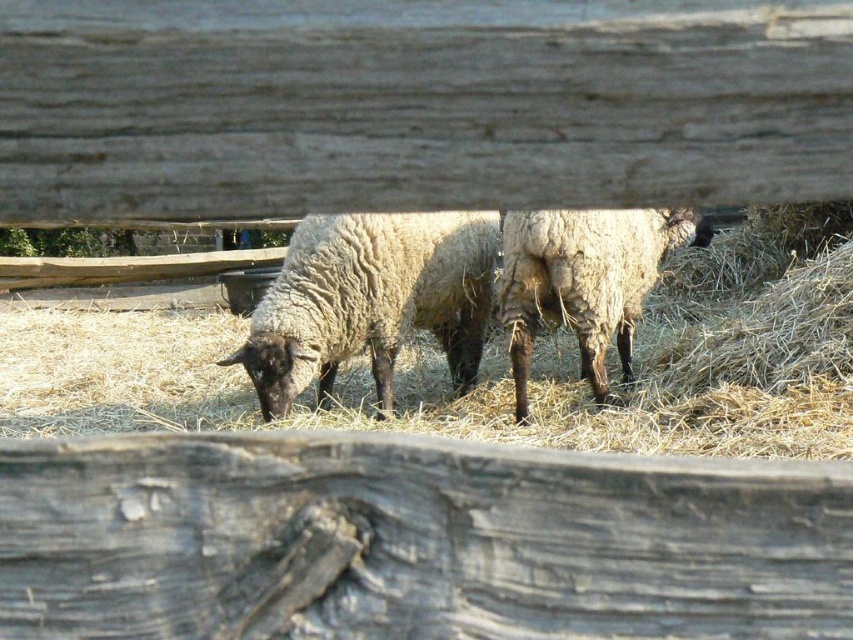
Does light brown straw at center appear on the left side of fuzzy white sheep at center?

Incorrect, light brown straw at center is not on the left side of fuzzy white sheep at center.

Is point (161, 362) more distant than point (376, 380)?

Yes, point (161, 362) is farther from viewer.

Describe the element at coordinates (473, 390) in the screenshot. This screenshot has width=853, height=640. I see `light brown straw at center` at that location.

Locate an element on the screen. light brown straw at center is located at coordinates (473, 390).

Can you confirm if light brown straw at center is positioned below fuzzy woolly sheep at center?

Indeed, light brown straw at center is positioned under fuzzy woolly sheep at center.

Describe the element at coordinates (473, 390) in the screenshot. I see `light brown straw at center` at that location.

Is point (781, 365) positioned after point (645, 252)?

That is False.

Locate an element on the screen. The width and height of the screenshot is (853, 640). light brown straw at center is located at coordinates (473, 390).

From the picture: Between fuzzy white sheep at center and fuzzy woolly sheep at center, which one appears on the right side from the viewer's perspective?

From the viewer's perspective, fuzzy woolly sheep at center appears more on the right side.

Who is more distant from viewer, [364,266] or [657,211]?

The point [364,266] is behind.

I want to click on fuzzy white sheep at center, so click(x=370, y=300).